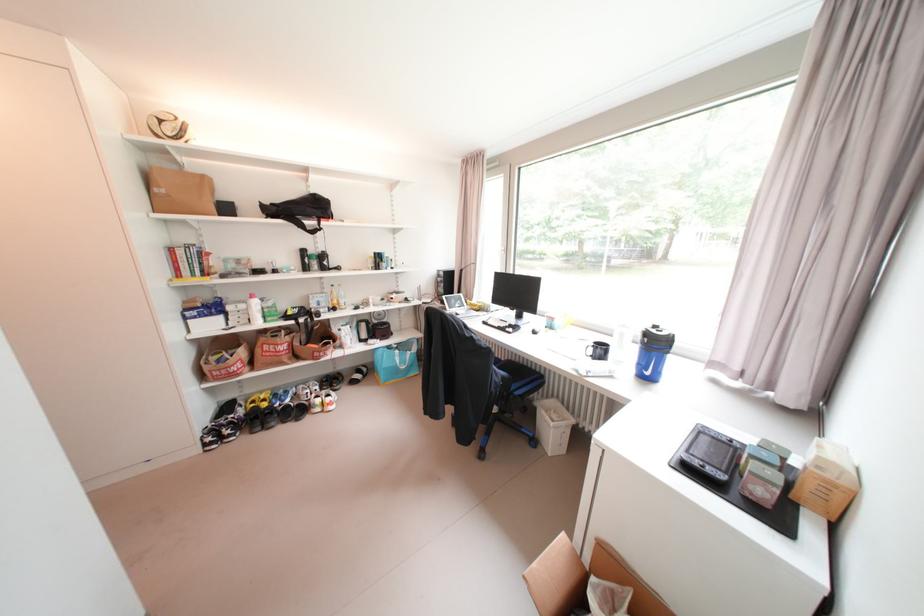
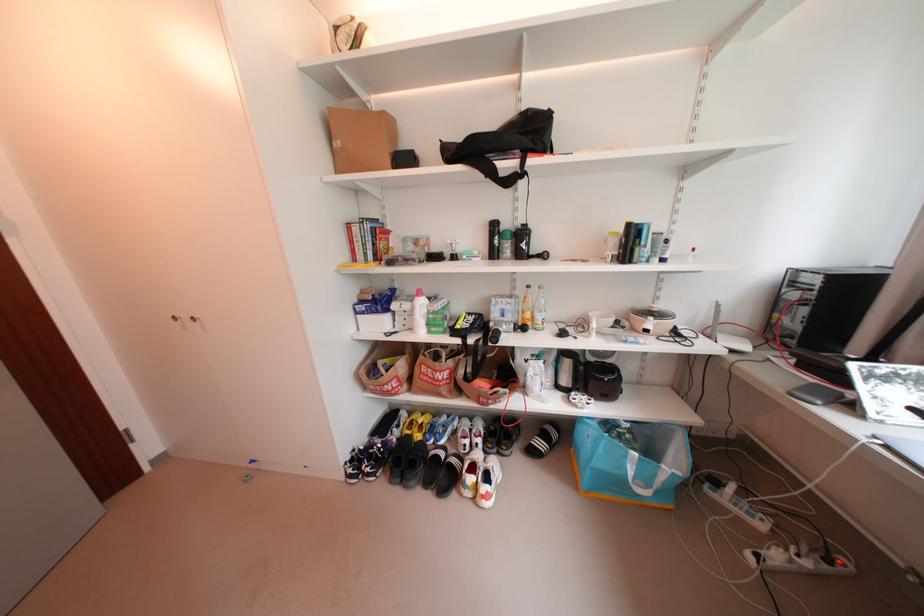
Where in the second image is the point corresponding to point (403, 294) from the first image?

(660, 320)